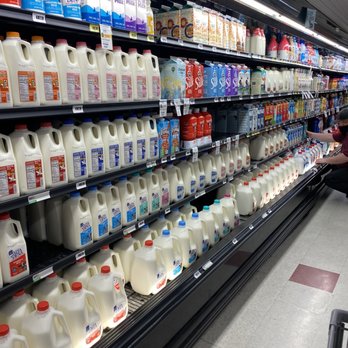
In order to click on half gallons of milk on the second shelf from the top in this screenshot , I will do `click(3, 84)`, `click(27, 81)`, `click(48, 80)`, `click(70, 84)`, `click(95, 84)`, `click(109, 81)`, `click(127, 81)`, `click(139, 81)`, `click(155, 82)`.